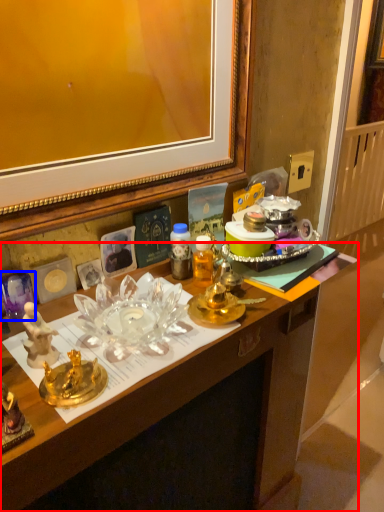
Question: Which point is further to the camera, desk (highlighted by a red box) or plate (highlighted by a blue box)?

Choices:
 (A) desk
 (B) plate

Answer: (B)